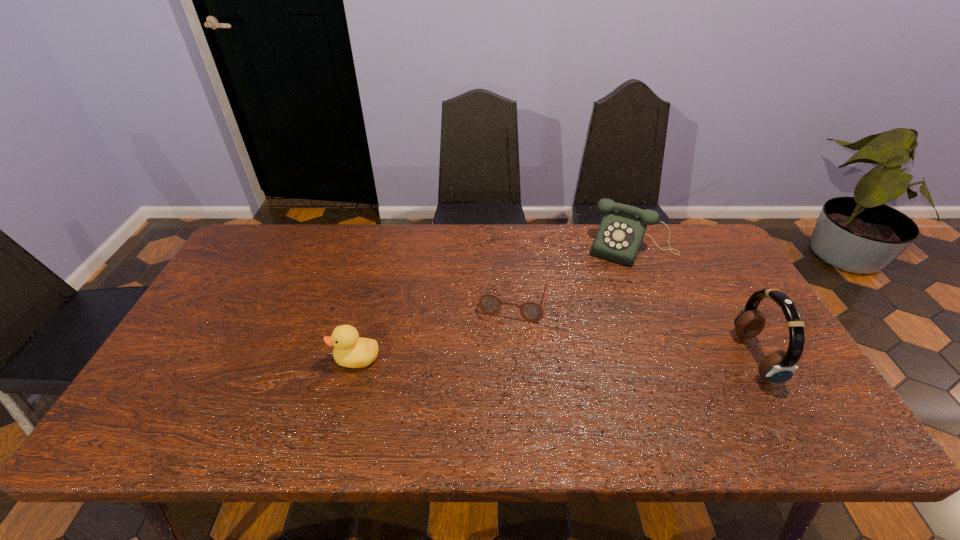
This screenshot has height=540, width=960. I want to click on headset at the right edge, so click(x=778, y=367).

Where is `telephone that is at the right edge`? This screenshot has height=540, width=960. telephone that is at the right edge is located at coordinates (620, 234).

Find the location of a particular element. object at the far right corner is located at coordinates (620, 234).

The height and width of the screenshot is (540, 960). Identify the location of object that is at the near right corner. (778, 367).

This screenshot has height=540, width=960. I want to click on free spot at the far edge of the desktop, so click(x=336, y=248).

Locate an element on the screen. The image size is (960, 540). vacant area at the near edge is located at coordinates (563, 377).

Image resolution: width=960 pixels, height=540 pixels. In order to click on vacant space at the left edge in this screenshot , I will do `click(268, 271)`.

Find the location of `vacant space at the right edge of the desktop`. vacant space at the right edge of the desktop is located at coordinates (712, 281).

In the image, there is a desktop. At what (x,y) coordinates should I click in order to perform the action: click on blank space at the far left corner. Please return your answer as a coordinate pair (x, y). This screenshot has width=960, height=540. Looking at the image, I should click on 275,261.

In the image, there is a desktop. Find the location of `vacant space at the far right corner`. vacant space at the far right corner is located at coordinates (676, 228).